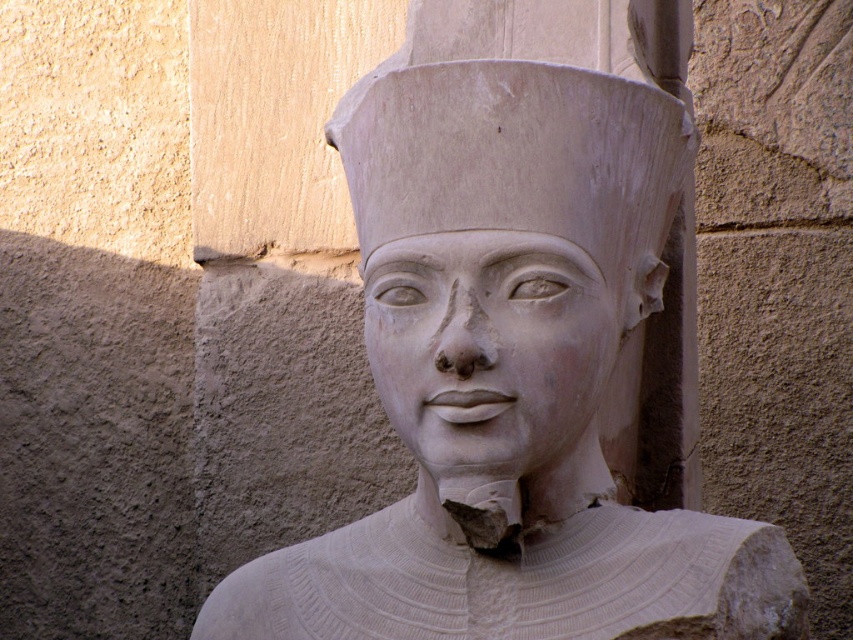
Which is behind, point (531, 154) or point (479, 237)?

Point (531, 154)

Based on the photo, which is above, white stone head at center or white stone face at center?

white stone head at center is higher up.

This screenshot has width=853, height=640. Identify the location of white stone head at center. (548, 205).

Does white stone statue at center appear on the left side of white stone head at center?

Yes, white stone statue at center is to the left of white stone head at center.

Which of these two, white stone statue at center or white stone head at center, stands taller?

white stone statue at center is taller.

Which is behind, point (799, 602) or point (657, 340)?

Point (657, 340)

This screenshot has width=853, height=640. Find the location of `white stone statue at center`. white stone statue at center is located at coordinates (527, 348).

Can you confirm if white stone statue at center is shorter than white stone face at center?

In fact, white stone statue at center may be taller than white stone face at center.

Between white stone statue at center and white stone face at center, which one appears on the right side from the viewer's perspective?

white stone face at center is more to the right.

I want to click on white stone statue at center, so [x=527, y=348].

The image size is (853, 640). I want to click on white stone statue at center, so click(527, 348).